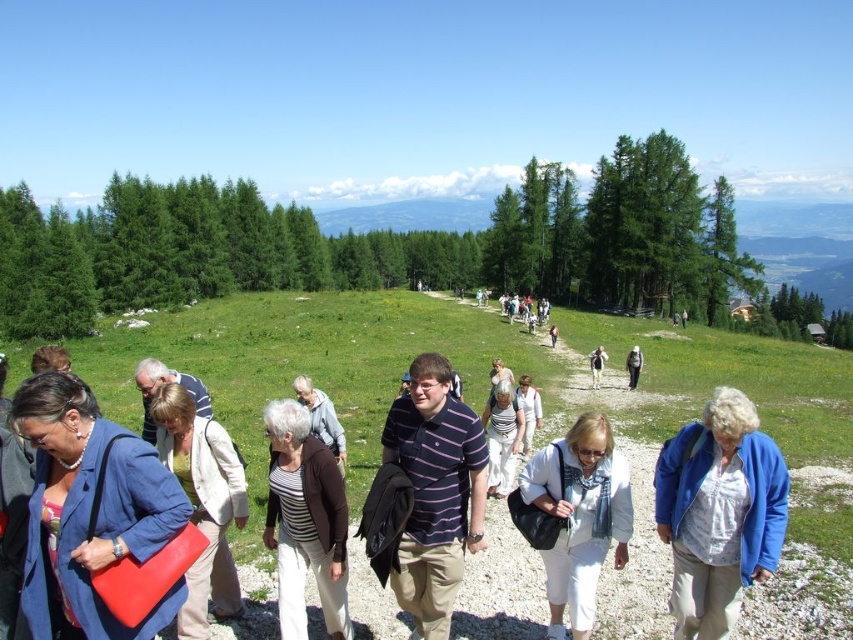
Does point (461, 524) come closer to viewer compared to point (554, 337)?

Yes, it is.

Can you confirm if striped cotton polo shirt at center is smaller than striped shirt at center?

Correct, striped cotton polo shirt at center occupies less space than striped shirt at center.

Is point (424, 568) positioned behind point (553, 340)?

No.

Find the location of a particular element. striped cotton polo shirt at center is located at coordinates (434, 492).

Consider the image. Can you confirm if striped cotton polo shirt at center is taller than striped sweater at center?

No.

How much distance is there between striped cotton polo shirt at center and striped sweater at center?

striped cotton polo shirt at center is 7.46 meters away from striped sweater at center.

Does point (409, 435) lie in front of point (144, 369)?

Yes, it is in front of point (144, 369).

Locate an element on the screen. striped cotton polo shirt at center is located at coordinates [434, 492].

Does blue fleece jacket at lower right appear over white cotton dress at center?

No.

Does point (718, 428) come in front of point (509, 456)?

That is True.

Locate an element on the screen. The image size is (853, 640). blue fleece jacket at lower right is located at coordinates (718, 513).

The width and height of the screenshot is (853, 640). I want to click on blue fleece jacket at lower right, so click(718, 513).